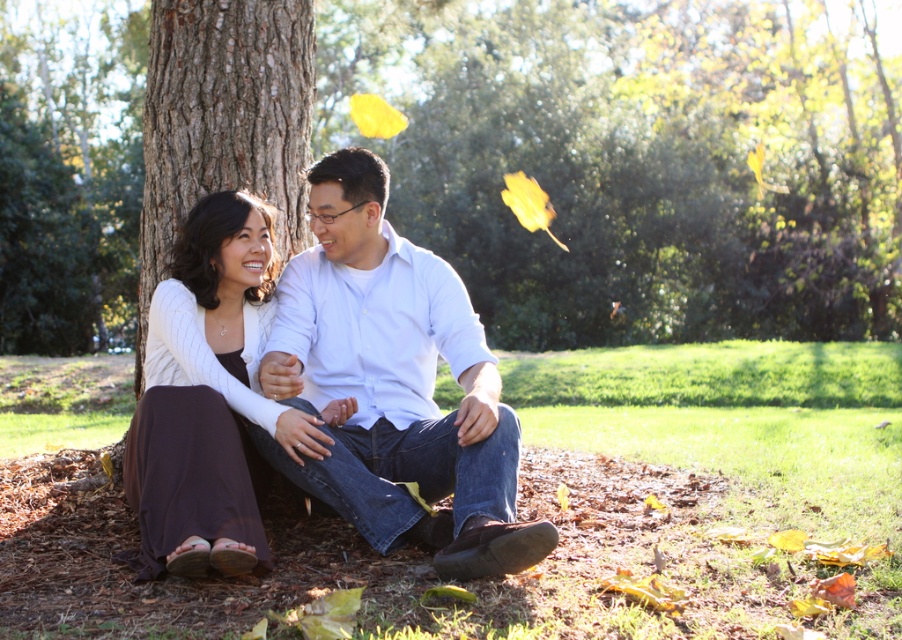
Is point (353, 202) closer to camera compared to point (251, 6)?

That is True.

Can you confirm if white cotton shirt at center is taller than brown textured bark at center?

No.

Image resolution: width=902 pixels, height=640 pixels. I want to click on white cotton shirt at center, so click(394, 381).

Is brown denim jeans at center thinner than white cotton shirt at center?

In fact, brown denim jeans at center might be wider than white cotton shirt at center.

Find the location of a particular element. The image size is (902, 640). brown denim jeans at center is located at coordinates (518, 500).

Is point (297, 268) positioned behind point (262, 250)?

Yes, it is behind point (262, 250).

Is white cotton shirt at center below matte white sweater at center?

Actually, white cotton shirt at center is above matte white sweater at center.

Is point (330, 378) more distant than point (181, 458)?

Yes, point (330, 378) is farther from viewer.

Locate an element on the screen. This screenshot has height=640, width=902. white cotton shirt at center is located at coordinates (394, 381).